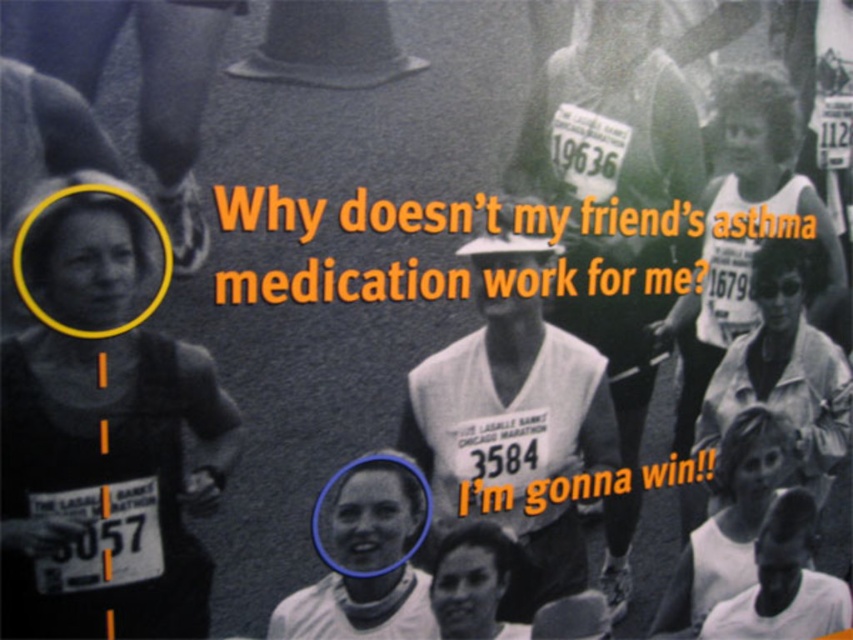
You are a medical professional observing the marathon participants. You notice two runners wearing tank tops labeled as white matte tank top at lower right and smooth white tank top at center. Based on their clothing, can you determine which runner might have a larger torso size?

The white matte tank top at lower right is larger in size than the smooth white tank top at center, so the runner wearing the white matte tank top at lower right likely has a larger torso size.

You are a runner in the marathon and want to pass through the crowd to reach the water station ahead. You see a matte black shirt at left and a smooth white tank top at center. Which runner should you move around to get past them quickly?

The matte black shirt at left is in front of the smooth white tank top at center, so you should move around the smooth white tank top at center since it is behind the other runner and might be easier to bypass.